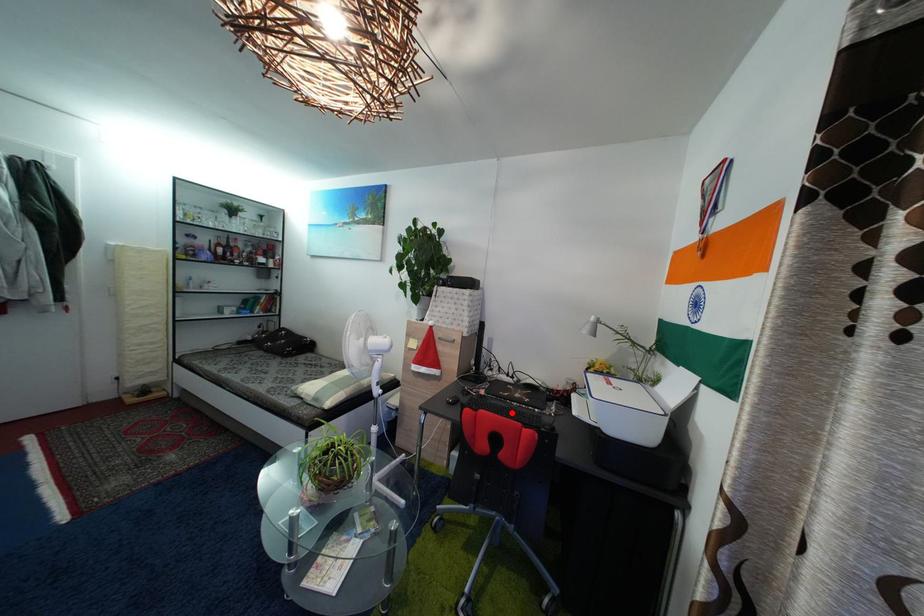
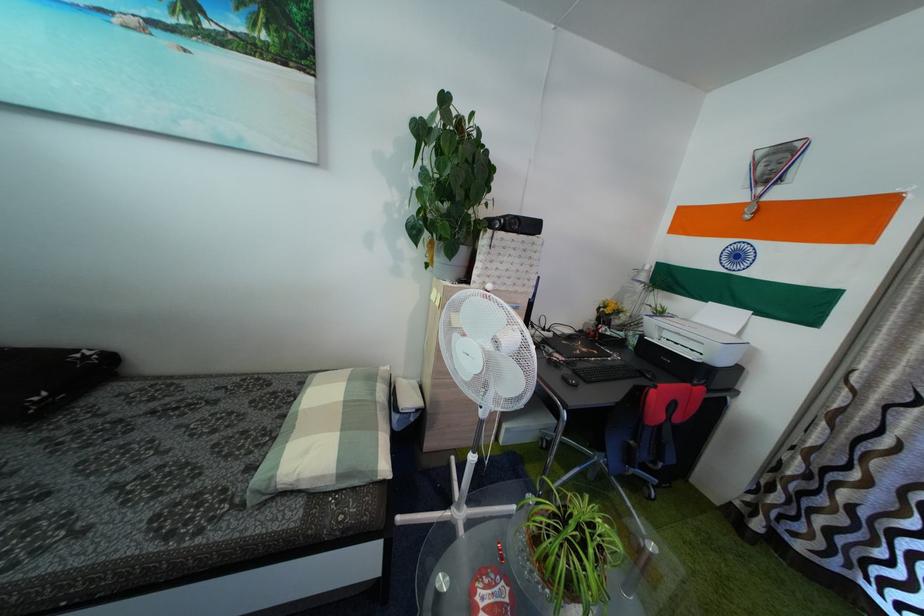
The point at the highlighted location is marked in the first image. Where is the corresponding point in the second image?

(599, 371)